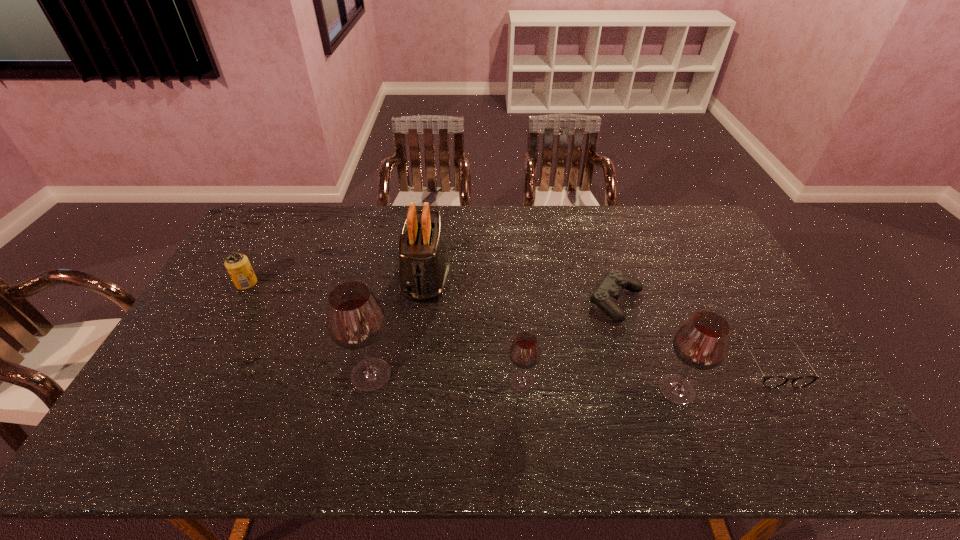
Locate an element on the screen. The image size is (960, 540). vacant region located 0.240m on the back of the leftmost wineglass is located at coordinates (389, 293).

Where is `vacant area situated on the right of the shortest wineglass`? vacant area situated on the right of the shortest wineglass is located at coordinates (598, 382).

What are the coordinates of `free spot located 0.150m on the back of the rightmost wineglass` in the screenshot? It's located at (654, 328).

Where is `blank area located 0.050m on the left of the third shortest object`? blank area located 0.050m on the left of the third shortest object is located at coordinates (221, 284).

This screenshot has width=960, height=540. What are the coordinates of `vacant position located 0.090m on the left of the second shortest object` in the screenshot? It's located at (559, 302).

I want to click on vacant space situated 0.210m on the side of the toaster with the control lever, so click(x=414, y=367).

At what (x,y) coordinates should I click in order to perform the action: click on spectacles that is at the near edge. Please return your answer as a coordinate pair (x, y). Looking at the image, I should click on (769, 381).

Where is `object that is at the left edge`? The height and width of the screenshot is (540, 960). object that is at the left edge is located at coordinates [238, 266].

Where is `object located in the right edge section of the desktop`? This screenshot has height=540, width=960. object located in the right edge section of the desktop is located at coordinates (769, 381).

Find the location of a particular element. This screenshot has width=960, height=540. object located at the near right corner is located at coordinates (769, 381).